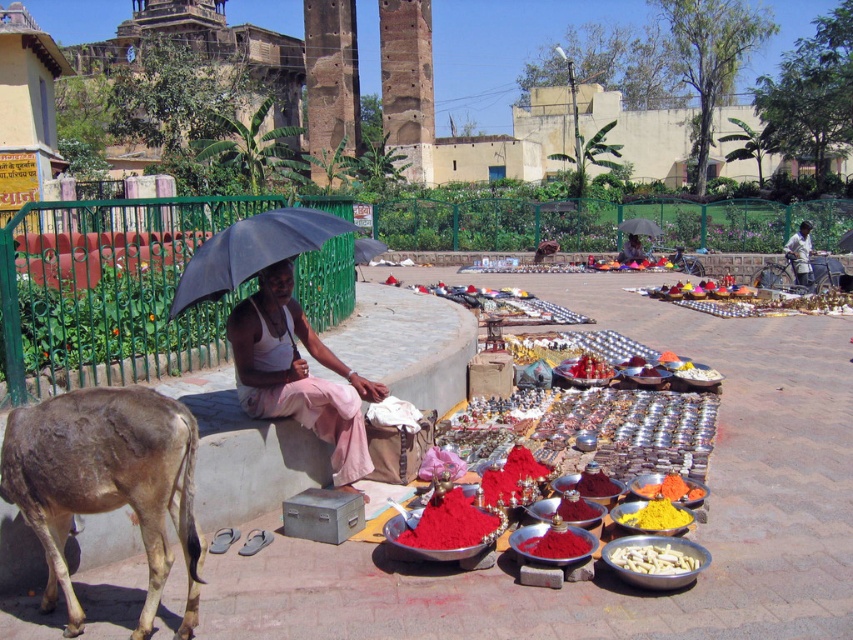
You are a food vendor at the market and you have two items displayed on your mat. The white matte food at lower center and the powdered red spice at center. A customer asks which item takes up more space on the mat. How do you respond?

The white matte food at lower center takes up more space on the mat because its width is larger than the powdered red spice at center.

You are a customer at the market and want to buy both the white matte food at lower center and the smooth red powder at center. Which item is closer to the ground?

The white matte food at lower center is closer to the ground since it is located below the smooth red powder at center.